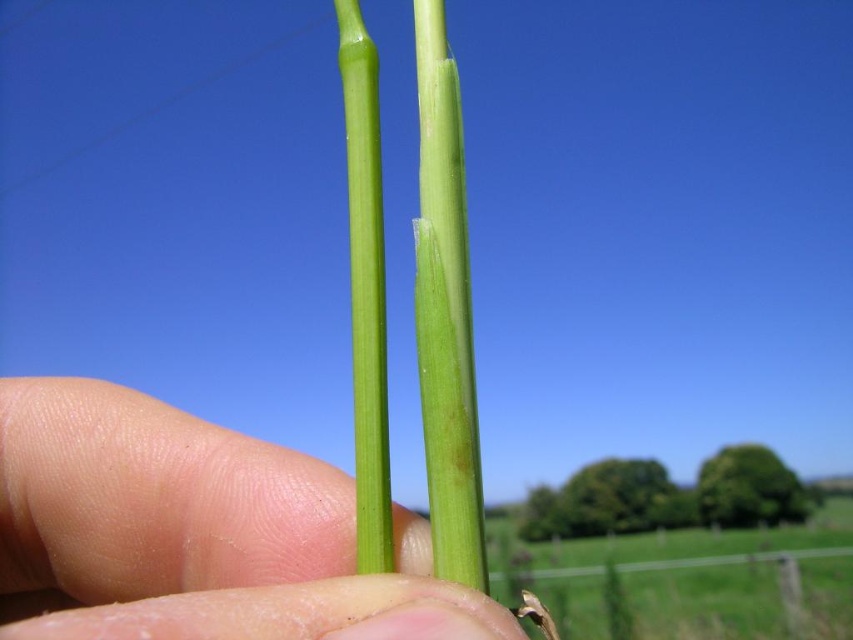
You are holding two plant stems in your hand against a countryside backdrop. You notice one has a split, and the other is intact. Which object, the smooth skin at center or the green smooth stem at center, is positioned closer to your eyes?

The smooth skin at center is closer to the viewer than the green smooth stem at center.

You are a gardener holding two plants, the green smooth grass at center and the green smooth stem at center. You need to place them in a garden bed that is 8 feet wide. Can both plants fit side by side without overlapping?

The green smooth grass at center and green smooth stem at center are 8.44 feet apart from each other. Since the garden bed is only 8 feet wide, the combined width of both plants exceeds the available space, so they cannot fit side by side without overlapping.

You are holding two parts of a plant between your fingers. One is the smooth skin at center and the other is the green smooth stem at center. Which one is shorter?

The smooth skin at center is shorter than the green smooth stem at center.